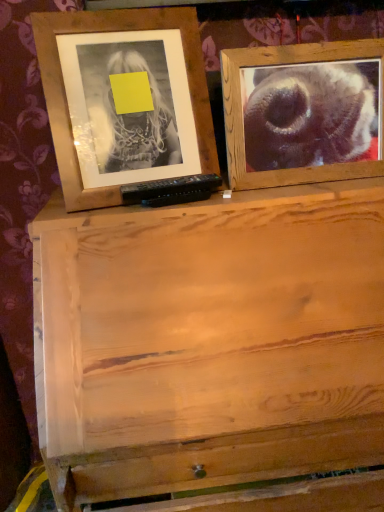
What do you see at coordinates (303, 113) in the screenshot? This screenshot has height=512, width=384. I see `wooden frame at upper right, positioned as the second picture frame in left-to-right order` at bounding box center [303, 113].

This screenshot has width=384, height=512. I want to click on wooden frame at upper right, acting as the first picture frame starting from the right, so click(x=303, y=113).

Describe the element at coordinates (65, 94) in the screenshot. Image resolution: width=384 pixels, height=512 pixels. I see `wooden frame at upper left, placed as the second picture frame when sorted from right to left` at that location.

Based on the photo, measure the distance between point (194, 114) and camera.

Point (194, 114) is 34.45 inches away from camera.

The width and height of the screenshot is (384, 512). Find the location of `wooden frame at upper left, which is the 1th picture frame in left-to-right order`. wooden frame at upper left, which is the 1th picture frame in left-to-right order is located at coordinates (65, 94).

Where is `wooden frame at upper right, positioned as the second picture frame in left-to-right order`? This screenshot has height=512, width=384. wooden frame at upper right, positioned as the second picture frame in left-to-right order is located at coordinates (303, 113).

Looking at this image, is wooden frame at upper right, acting as the first picture frame starting from the right, to the left of wooden frame at upper left, placed as the second picture frame when sorted from right to left, from the viewer's perspective?

No.

Is the position of wooden frame at upper right, acting as the first picture frame starting from the right, less distant than that of wooden frame at upper left, which is the 1th picture frame in left-to-right order?

No.

Does point (243, 141) lie in front of point (199, 111)?

No, it is behind (199, 111).

From the image's perspective, is wooden frame at upper right, positioned as the second picture frame in left-to-right order, located beneath wooden frame at upper left, placed as the second picture frame when sorted from right to left?

Yes, from the image's perspective, wooden frame at upper right, positioned as the second picture frame in left-to-right order, is below wooden frame at upper left, placed as the second picture frame when sorted from right to left.

From a real-world perspective, is wooden frame at upper right, acting as the first picture frame starting from the right, above or below wooden frame at upper left, placed as the second picture frame when sorted from right to left?

Clearly, from a real-world perspective, wooden frame at upper right, acting as the first picture frame starting from the right, is below wooden frame at upper left, placed as the second picture frame when sorted from right to left.

In terms of width, does wooden frame at upper right, positioned as the second picture frame in left-to-right order, look wider or thinner when compared to wooden frame at upper left, placed as the second picture frame when sorted from right to left?

Clearly, wooden frame at upper right, positioned as the second picture frame in left-to-right order, has less width compared to wooden frame at upper left, placed as the second picture frame when sorted from right to left.

Which of these two, wooden frame at upper right, acting as the first picture frame starting from the right, or wooden frame at upper left, placed as the second picture frame when sorted from right to left, stands taller?

wooden frame at upper left, placed as the second picture frame when sorted from right to left.

Which of these two, wooden frame at upper right, acting as the first picture frame starting from the right, or wooden frame at upper left, which is the 1th picture frame in left-to-right order, is smaller?

wooden frame at upper right, acting as the first picture frame starting from the right, is smaller.

Would you say wooden frame at upper left, placed as the second picture frame when sorted from right to left, is part of wooden frame at upper right, acting as the first picture frame starting from the right,'s contents?

No, wooden frame at upper right, acting as the first picture frame starting from the right, does not contain wooden frame at upper left, placed as the second picture frame when sorted from right to left.

Is wooden frame at upper right, positioned as the second picture frame in left-to-right order, far away from wooden frame at upper left, which is the 1th picture frame in left-to-right order?

No, wooden frame at upper right, positioned as the second picture frame in left-to-right order, is not far away from wooden frame at upper left, which is the 1th picture frame in left-to-right order.

Is wooden frame at upper right, positioned as the second picture frame in left-to-right order, oriented towards wooden frame at upper left, placed as the second picture frame when sorted from right to left?

No, wooden frame at upper right, positioned as the second picture frame in left-to-right order, does not turn towards wooden frame at upper left, placed as the second picture frame when sorted from right to left.

How different are the orientations of wooden frame at upper right, positioned as the second picture frame in left-to-right order, and wooden frame at upper left, placed as the second picture frame when sorted from right to left, in degrees?

The angular difference between wooden frame at upper right, positioned as the second picture frame in left-to-right order, and wooden frame at upper left, placed as the second picture frame when sorted from right to left, is 10.8 degrees.

Identify the location of picture frame to the right of wooden frame at upper left, which is the 1th picture frame in left-to-right order. (303, 113).

Visually, is wooden frame at upper left, which is the 1th picture frame in left-to-right order, positioned to the left or to the right of wooden frame at upper right, positioned as the second picture frame in left-to-right order?

Based on their positions, wooden frame at upper left, which is the 1th picture frame in left-to-right order, is located to the left of wooden frame at upper right, positioned as the second picture frame in left-to-right order.

Considering their positions, is wooden frame at upper left, which is the 1th picture frame in left-to-right order, located in front of or behind wooden frame at upper right, acting as the first picture frame starting from the right?

Visually, wooden frame at upper left, which is the 1th picture frame in left-to-right order, is located in front of wooden frame at upper right, acting as the first picture frame starting from the right.

Is point (33, 30) behind point (234, 122)?

That is False.

From the image's perspective, is wooden frame at upper left, placed as the second picture frame when sorted from right to left, beneath wooden frame at upper right, positioned as the second picture frame in left-to-right order?

No, from the image's perspective, wooden frame at upper left, placed as the second picture frame when sorted from right to left, is not below wooden frame at upper right, positioned as the second picture frame in left-to-right order.

From a real-world perspective, which object rests below the other?

In real-world perspective, wooden frame at upper right, acting as the first picture frame starting from the right, is lower.

Considering the sizes of wooden frame at upper left, placed as the second picture frame when sorted from right to left, and wooden frame at upper right, acting as the first picture frame starting from the right, in the image, is wooden frame at upper left, placed as the second picture frame when sorted from right to left, wider or thinner than wooden frame at upper right, acting as the first picture frame starting from the right,?

wooden frame at upper left, placed as the second picture frame when sorted from right to left, is wider than wooden frame at upper right, acting as the first picture frame starting from the right.

Between wooden frame at upper left, placed as the second picture frame when sorted from right to left, and wooden frame at upper right, acting as the first picture frame starting from the right, which one has more height?

wooden frame at upper left, placed as the second picture frame when sorted from right to left, is taller.

Can you confirm if wooden frame at upper left, placed as the second picture frame when sorted from right to left, is smaller than wooden frame at upper right, acting as the first picture frame starting from the right?

Actually, wooden frame at upper left, placed as the second picture frame when sorted from right to left, might be larger than wooden frame at upper right, acting as the first picture frame starting from the right.

Consider the image. Does wooden frame at upper left, which is the 1th picture frame in left-to-right order, contain wooden frame at upper right, positioned as the second picture frame in left-to-right order?

No, wooden frame at upper right, positioned as the second picture frame in left-to-right order, is not a part of wooden frame at upper left, which is the 1th picture frame in left-to-right order.

Is wooden frame at upper left, placed as the second picture frame when sorted from right to left, directly adjacent to wooden frame at upper right, positioned as the second picture frame in left-to-right order?

wooden frame at upper left, placed as the second picture frame when sorted from right to left, is not next to wooden frame at upper right, positioned as the second picture frame in left-to-right order, and they're not touching.

Is wooden frame at upper left, which is the 1th picture frame in left-to-right order, oriented away from wooden frame at upper right, acting as the first picture frame starting from the right?

No.

The width and height of the screenshot is (384, 512). What are the coordinates of `picture frame located above the wooden frame at upper right, positioned as the second picture frame in left-to-right order (from a real-world perspective)` in the screenshot? It's located at (x=65, y=94).

At what (x,y) coordinates should I click in order to perform the action: click on picture frame on the left side of wooden frame at upper right, acting as the first picture frame starting from the right. Please return your answer as a coordinate pair (x, y). The image size is (384, 512). Looking at the image, I should click on (65, 94).

Locate an element on the screen. This screenshot has height=512, width=384. picture frame behind the wooden frame at upper left, which is the 1th picture frame in left-to-right order is located at coordinates (303, 113).